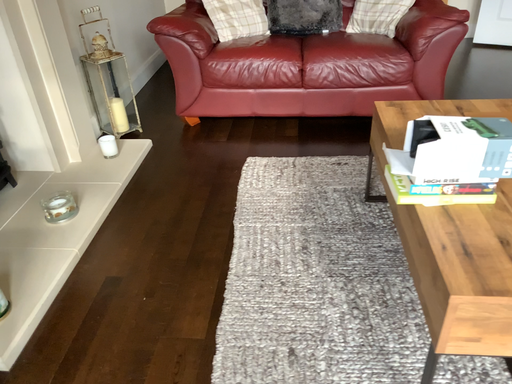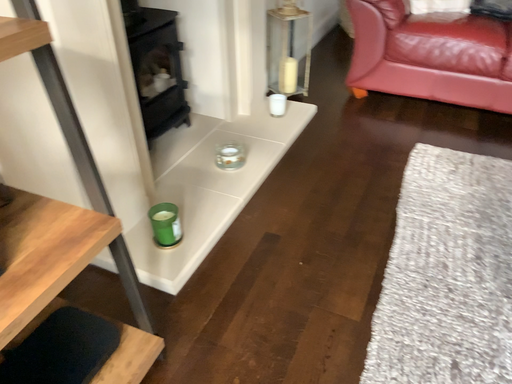
Question: Which way did the camera rotate in the video?

Choices:
 (A) rotated right
 (B) rotated left

Answer: (B)